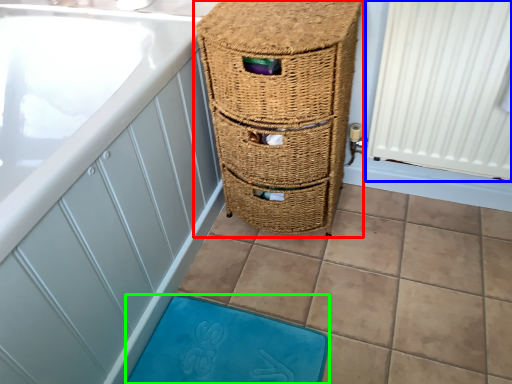
Question: Estimate the real-world distances between objects in this image. Which object is farther from furniture (highlighted by a red box), radiator (highlighted by a blue box) or bath mat (highlighted by a green box)?

Choices:
 (A) radiator
 (B) bath mat

Answer: (B)